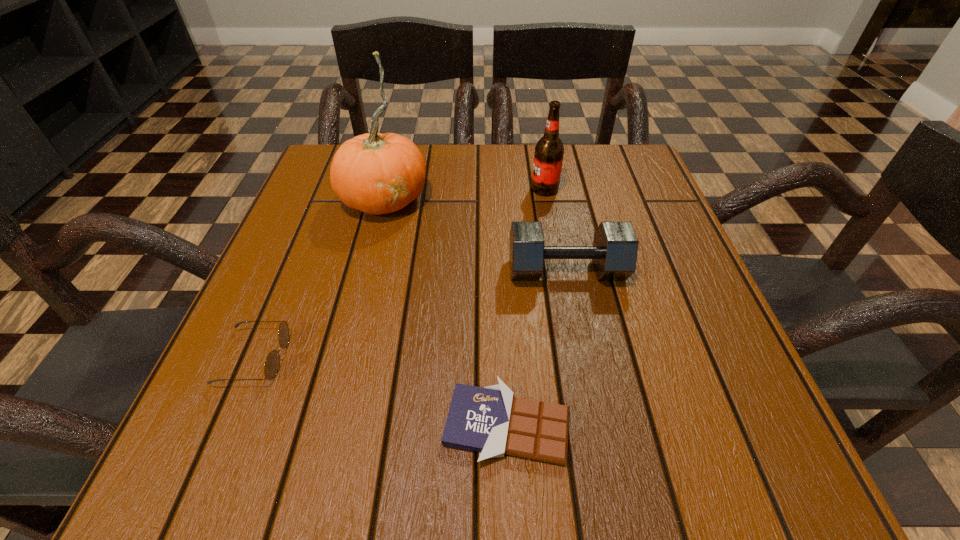
The height and width of the screenshot is (540, 960). In order to click on pumpkin in this screenshot , I will do `click(375, 173)`.

The height and width of the screenshot is (540, 960). I want to click on the second tallest object, so click(549, 151).

Find the location of a particular element. the third tallest object is located at coordinates (614, 252).

Find the location of a particular element. Image resolution: width=960 pixels, height=540 pixels. the third farthest object is located at coordinates (614, 252).

This screenshot has width=960, height=540. What are the coordinates of `the fourth tallest object` in the screenshot? It's located at (272, 363).

Where is `the shortest object`? the shortest object is located at coordinates (490, 420).

The width and height of the screenshot is (960, 540). Identify the location of free space located 0.060m on the left of the tallest object. (315, 198).

The height and width of the screenshot is (540, 960). I want to click on vacant area located on the front of the second tallest object, so click(549, 213).

What are the coordinates of `vacant space located 0.260m on the back of the third farthest object` in the screenshot? It's located at (548, 179).

In order to click on free space located 0.280m on the lenses of the second shortest object in this screenshot , I will do `click(460, 357)`.